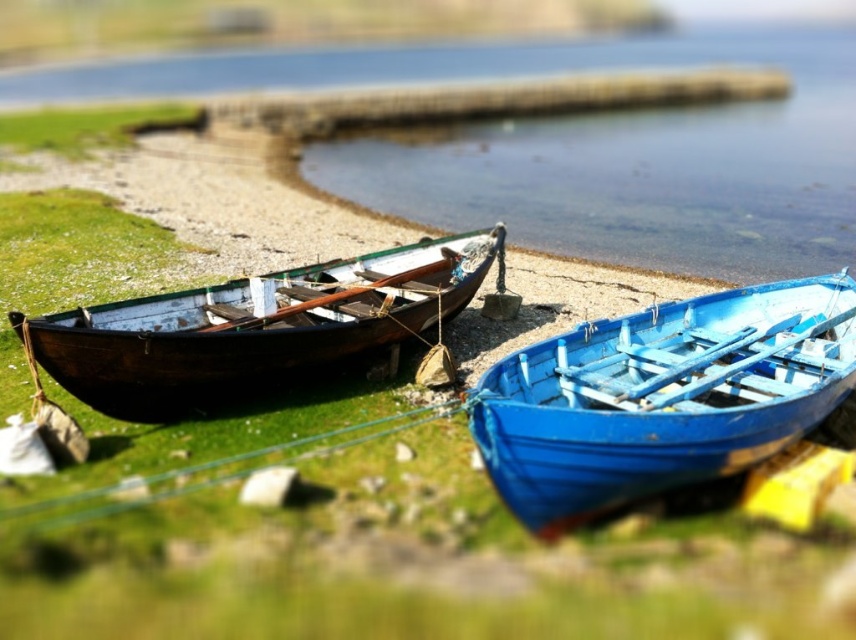
Question: Which point is closer to the camera?

Choices:
 (A) (447, 256)
 (B) (837, 332)

Answer: (B)

Question: Is blue matte boat at lower right positioned before wooden boat at left?

Choices:
 (A) yes
 (B) no

Answer: (A)

Question: Is the position of blue matte boat at lower right less distant than that of wooden boat at left?

Choices:
 (A) no
 (B) yes

Answer: (B)

Question: Which of the following is the closest to the observer?

Choices:
 (A) blue matte boat at lower right
 (B) wooden boat at left

Answer: (A)

Question: Can you confirm if blue matte boat at lower right is wider than wooden boat at left?

Choices:
 (A) yes
 (B) no

Answer: (A)

Question: Which point is farther from the camera taking this photo?

Choices:
 (A) (845, 285)
 (B) (276, 321)

Answer: (A)